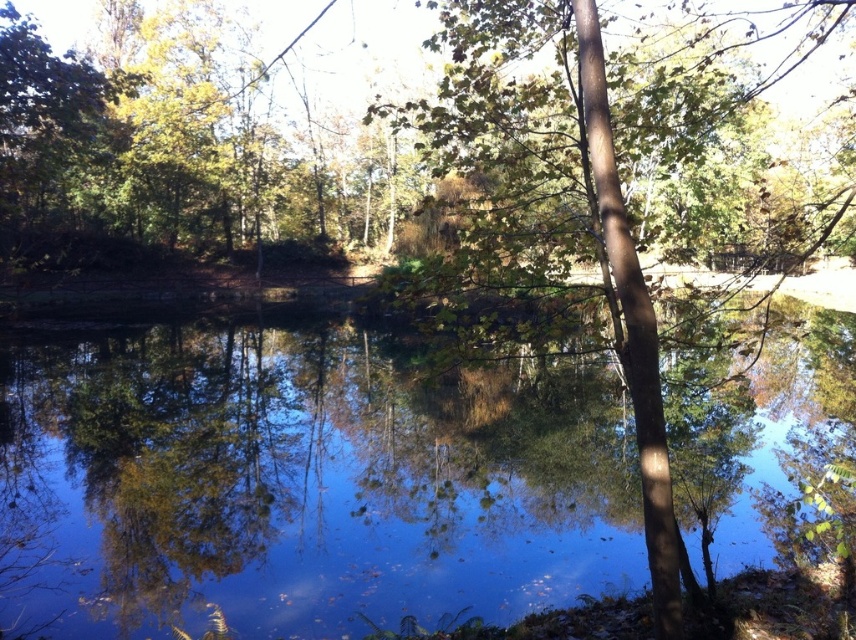
Is green matte tree at center shorter than green leafy tree at center?

Correct, green matte tree at center is not as tall as green leafy tree at center.

Locate an element on the screen. Image resolution: width=856 pixels, height=640 pixels. green matte tree at center is located at coordinates (542, 216).

Can you confirm if transparent water at center is shorter than green leafy tree at center?

Indeed, transparent water at center has a lesser height compared to green leafy tree at center.

Does transparent water at center have a greater height compared to green leafy tree at center?

Incorrect, transparent water at center's height is not larger of green leafy tree at center's.

The width and height of the screenshot is (856, 640). Describe the element at coordinates (301, 484) in the screenshot. I see `transparent water at center` at that location.

Find the location of a particular element. This screenshot has width=856, height=640. transparent water at center is located at coordinates (301, 484).

Is transparent water at center taller than green matte tree at center?

In fact, transparent water at center may be shorter than green matte tree at center.

Is point (275, 580) closer to camera compared to point (611, 244)?

No.

The height and width of the screenshot is (640, 856). Find the location of `transparent water at center`. transparent water at center is located at coordinates (301, 484).